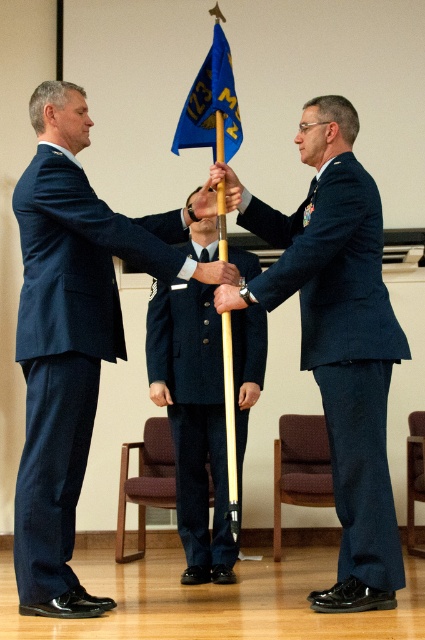
Wait, the two objects are the same? The user might have made a mistake. Let me check the rules again. The Objects must be a list of one or more object labels separated by pipes. Here, they have two entries but both are navy blue uniform at center. That can lead to confusion. Maybe it was a typo. Perhaps the second one should be navy blue fabric uniform at center? Or maybe different positions? Hmm, but I have to follow the input exactly. The user provided two identical object labels. So I have to proceed as

The navy blue fabric uniform at center is to the right of navy blue uniform at center.

You are a photographer positioned at the front of the room. You need to capture a closeup shot of the navy blue fabric uniform at center and the blue fabric flag at upper center in the same frame. Which object should you zoom in on first to ensure both are in focus?

The navy blue fabric uniform at center is wider than the blue fabric flag at upper center, so you should zoom in on the navy blue fabric uniform at center first to ensure both are in focus.